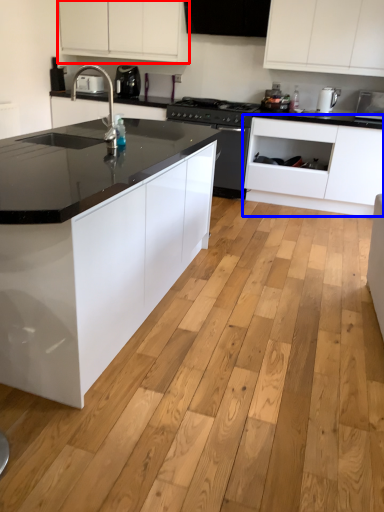
Question: Which of the following is the farthest to the observer, cabinetry (highlighted by a red box) or cabinetry (highlighted by a blue box)?

Choices:
 (A) cabinetry
 (B) cabinetry

Answer: (A)